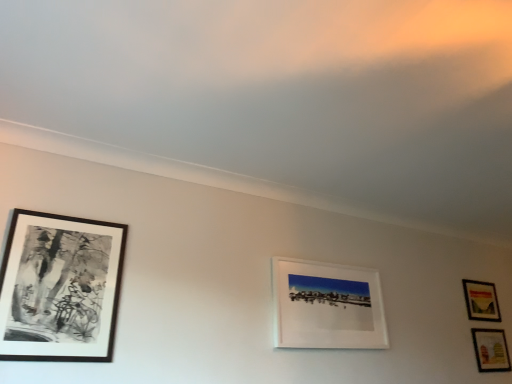
Question: Does black matte picture frame at left, which is the first picture frame from left to right, turn towards matte wooden picture frame at lower right, which is counted as the second picture frame, starting from the back?

Choices:
 (A) yes
 (B) no

Answer: (B)

Question: Is black matte picture frame at left, the 4th picture frame viewed from the right, closer to the viewer compared to matte wooden picture frame at lower right, marked as the third picture frame in a front-to-back arrangement?

Choices:
 (A) no
 (B) yes

Answer: (B)

Question: Does black matte picture frame at left, which is the first picture frame from left to right, lie behind matte wooden picture frame at lower right, arranged as the 4th picture frame when viewed from the left?

Choices:
 (A) yes
 (B) no

Answer: (B)

Question: Is black matte picture frame at left, the 4th picture frame viewed from the right, to the left of matte wooden picture frame at lower right, which is counted as the second picture frame, starting from the back, from the viewer's perspective?

Choices:
 (A) no
 (B) yes

Answer: (B)

Question: From the image's perspective, would you say black matte picture frame at left, which is the first picture frame from left to right, is positioned over matte wooden picture frame at lower right, arranged as the 4th picture frame when viewed from the left?

Choices:
 (A) yes
 (B) no

Answer: (A)

Question: Considering the positions of black matte picture frame at left, the 4th picture frame viewed from the right, and matte wooden picture frame at right, the 3th picture frame when ordered from left to right, in the image, is black matte picture frame at left, the 4th picture frame viewed from the right, bigger or smaller than matte wooden picture frame at right, the 3th picture frame when ordered from left to right,?

Choices:
 (A) big
 (B) small

Answer: (A)

Question: From the image's perspective, is black matte picture frame at left, which is the fourth picture frame in back-to-front order, above or below matte wooden picture frame at right, the 4th picture frame viewed from the front?

Choices:
 (A) below
 (B) above

Answer: (B)

Question: Considering the positions of point (72, 301) and point (480, 304), is point (72, 301) closer or farther from the camera than point (480, 304)?

Choices:
 (A) farther
 (B) closer

Answer: (B)

Question: Considering the relative positions of black matte picture frame at left, the 4th picture frame viewed from the right, and matte wooden picture frame at right, the 3th picture frame when ordered from left to right, in the image provided, is black matte picture frame at left, the 4th picture frame viewed from the right, to the left or to the right of matte wooden picture frame at right, the 3th picture frame when ordered from left to right,?

Choices:
 (A) left
 (B) right

Answer: (A)

Question: In terms of size, does matte wooden picture frame at right, the 3th picture frame when ordered from left to right, appear bigger or smaller than black matte picture frame at left, which is the first picture frame from left to right?

Choices:
 (A) small
 (B) big

Answer: (A)

Question: Is point (468, 279) closer or farther from the camera than point (18, 223)?

Choices:
 (A) farther
 (B) closer

Answer: (A)

Question: From the image's perspective, relative to black matte picture frame at left, which is the fourth picture frame in back-to-front order, is matte wooden picture frame at right, placed as the second picture frame when sorted from right to left, above or below?

Choices:
 (A) above
 (B) below

Answer: (B)

Question: Relative to black matte picture frame at left, the 4th picture frame viewed from the right, is matte wooden picture frame at right, the 1th picture frame when ordered from back to front, in front or behind?

Choices:
 (A) behind
 (B) front

Answer: (A)

Question: From the image's perspective, is matte wooden picture frame at lower right, marked as the 1th picture frame in a right-to-left arrangement, located above or below white matte picture frame at center, which is the 3th picture frame from right to left?

Choices:
 (A) above
 (B) below

Answer: (B)

Question: In the image, is matte wooden picture frame at lower right, which is counted as the second picture frame, starting from the back, positioned in front of or behind white matte picture frame at center, arranged as the third picture frame when viewed from the back?

Choices:
 (A) behind
 (B) front

Answer: (A)